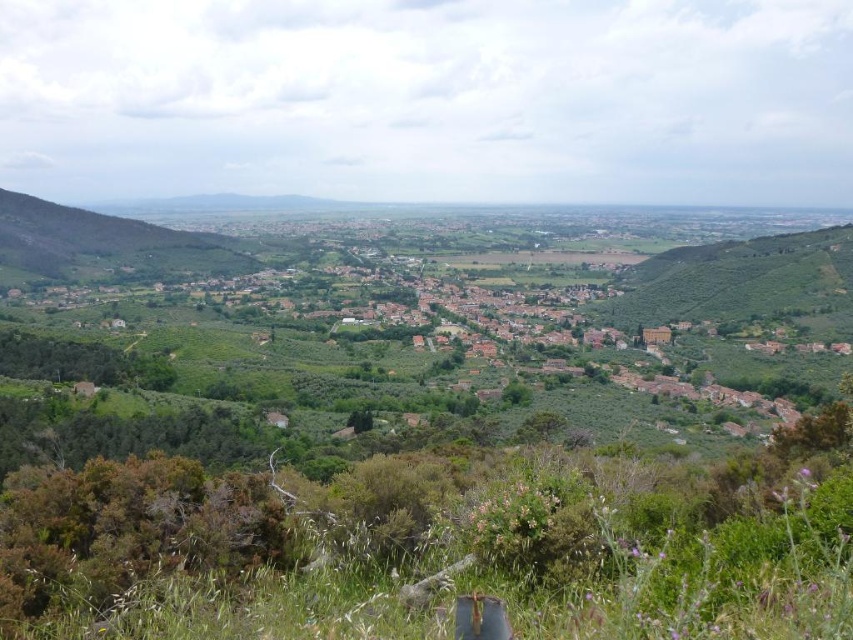
Which of these two, green leafy grass at lower center or green leafy hillside at left, stands taller?

Standing taller between the two is green leafy hillside at left.

Who is lower down, green leafy grass at lower center or green leafy hillside at left?

green leafy grass at lower center

You are a GUI agent. You are given a task and a screenshot of the screen. Output one action in this format:
    pyautogui.click(x=<x>, y=<y>)
    Task: Click on the green leafy grass at lower center
    This screenshot has width=853, height=640.
    Given the screenshot: What is the action you would take?
    pyautogui.click(x=416, y=556)